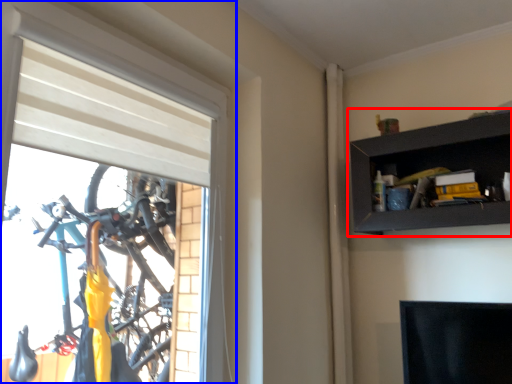
Question: Which object appears closest to the camera in this image, shelf (highlighted by a red box) or window (highlighted by a blue box)?

Choices:
 (A) shelf
 (B) window

Answer: (B)